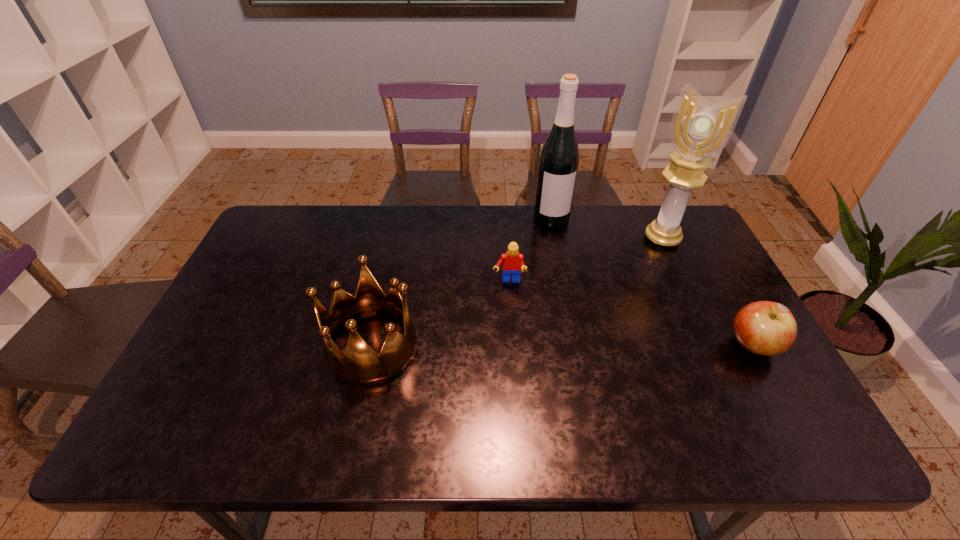
The image size is (960, 540). What are the coordinates of `free point between the award and the Lego` in the screenshot? It's located at (586, 260).

Image resolution: width=960 pixels, height=540 pixels. I want to click on free space that is in between the fourth object from right to left and the award, so click(586, 260).

This screenshot has height=540, width=960. Identify the location of empty space between the second object from left to right and the third object from right to left. (530, 250).

I want to click on empty space between the third tallest object and the apple, so click(x=563, y=347).

Locate an element on the screen. vacant area between the wine bottle and the award is located at coordinates (607, 228).

The image size is (960, 540). What are the coordinates of `free space between the third object from right to left and the award` in the screenshot? It's located at (607, 228).

This screenshot has height=540, width=960. Identify the location of vacant area that lies between the leftmost object and the apple. (563, 347).

This screenshot has width=960, height=540. In order to click on unoccupied area between the third object from left to right and the third shortest object in this screenshot , I will do `click(462, 283)`.

The height and width of the screenshot is (540, 960). Identify the location of object that is the closest to the apple. (698, 130).

Locate which object ranks in proximity to the award. Please provide its 2D coordinates. Your answer should be formatted as a tuple, i.e. [(x, y)], where the tuple contains the x and y coordinates of a point satisfying the conditions above.

[(559, 158)]